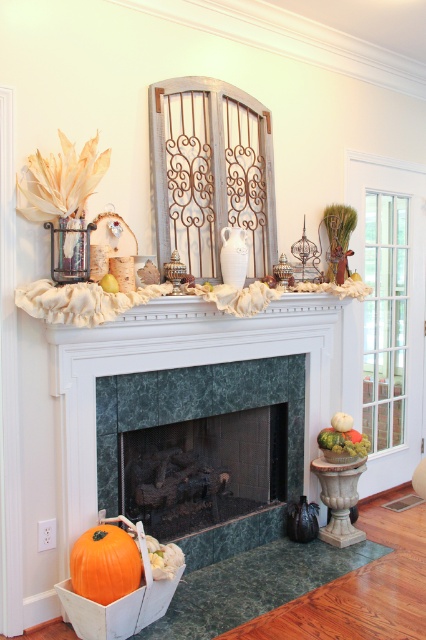
You are standing in the room and want to place a new decorative item on the mantel. The mantel is part of the green marble fireplace at center. Where on the mantel should you place the item if you want it to be centered exactly at the point specified in the description?

The green marble fireplace at center has its mantel located at the coordinates specified in the description, so placing the item at point (195,406) would center it correctly.

You are standing in the room and want to place a 3D printed model of a house that is 2.5 meters tall on the green marble fireplace at center. Will the model fit on the fireplace?

The green marble fireplace at center is 2.56 meters away from camera. The distance between you and the fireplace is not related to the height of the fireplace itself. Therefore, it is impossible to determine if the 3D printed model of a house will fit on the fireplace based on the given information.